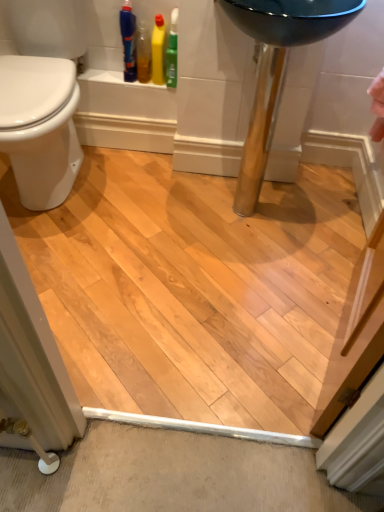
The image size is (384, 512). Identify the location of free spot to the left of blue plastic bottle at upper left. (105, 75).